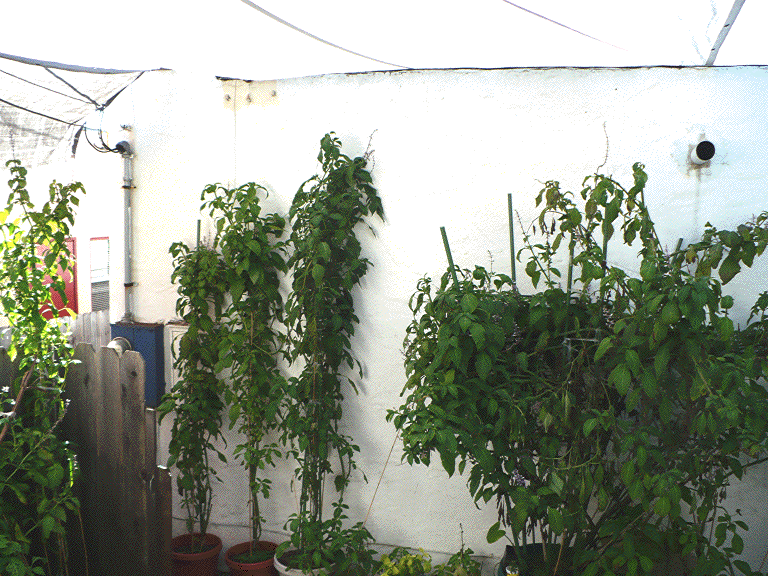
Where is `tall green plants`? This screenshot has height=576, width=768. tall green plants is located at coordinates (192, 328), (250, 317), (319, 322).